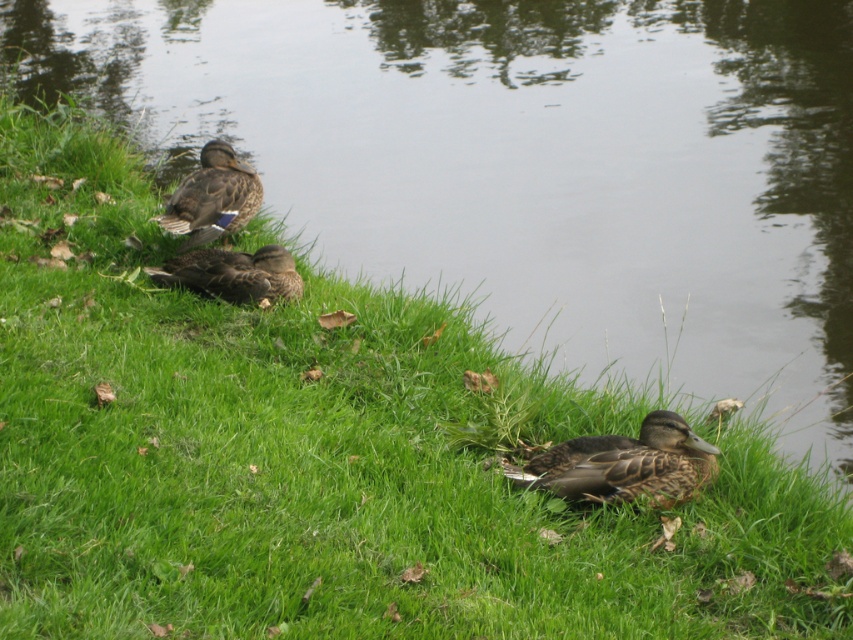
You are a wildlife photographer trying to capture a photo of the brown speckled duck at center and the brown feathered duck at upper left in the same frame. Your camera has a maximum focus range of 10 feet. Can you fit both ducks into the frame without moving your position?

The brown speckled duck at center and brown feathered duck at upper left are 10.71 feet apart, which exceeds the camera maximum focus range of 10 feet. Therefore, you cannot fit both ducks into the frame without moving your position.

You are a wildlife photographer aiming to capture the ducks in the scene. You want to ensure your camera frame can accommodate both the brown speckled duck at center and the brown feathered duck at upper left. Based on their sizes, which duck requires a wider frame to capture fully?

The brown speckled duck at center might require a wider frame since it might be wider than the brown feathered duck at upper left.